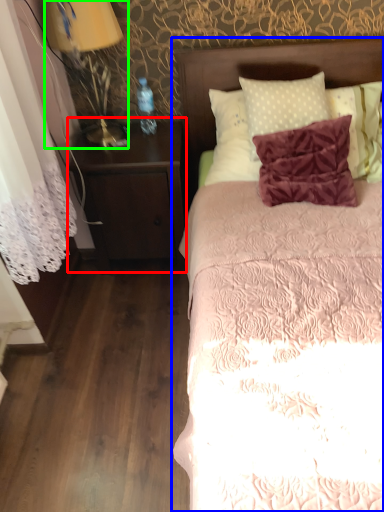
Question: Which object is the farthest from nightstand (highlighted by a red box)? Choose among these: bed (highlighted by a blue box) or bedside lamp (highlighted by a green box).

Choices:
 (A) bed
 (B) bedside lamp

Answer: (A)